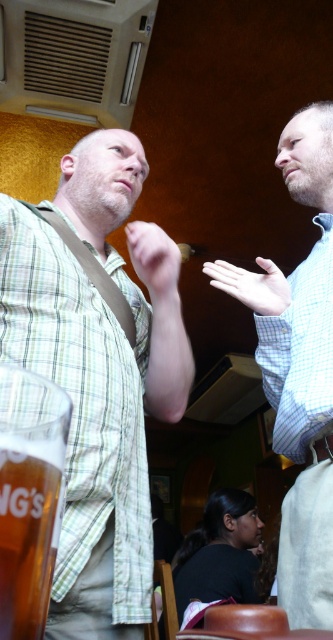
Question: Does blue checkered shirt at upper right appear over translucent glass mug at lower left?

Choices:
 (A) yes
 (B) no

Answer: (A)

Question: Which of these objects is positioned farthest from the blue checkered shirt at upper right?

Choices:
 (A) translucent glass mug at lower left
 (B) green plaid shirt at center

Answer: (A)

Question: Which of the following is the farthest from the observer?

Choices:
 (A) translucent glass mug at lower left
 (B) green plaid shirt at center
 (C) blue checkered shirt at upper right

Answer: (C)

Question: Which of the following is the farthest from the observer?

Choices:
 (A) (43, 593)
 (B) (104, 260)
 (C) (291, 340)

Answer: (B)

Question: Does blue checkered shirt at upper right have a lesser width compared to translucent glass mug at lower left?

Choices:
 (A) no
 (B) yes

Answer: (A)

Question: Observing the image, what is the correct spatial positioning of green plaid shirt at center in reference to blue checkered shirt at upper right?

Choices:
 (A) below
 (B) above

Answer: (A)